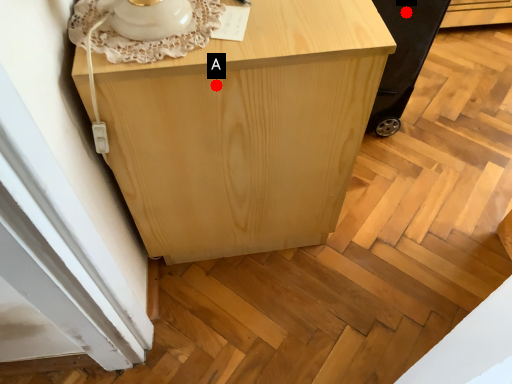
Question: Two points are circled on the image, labeled by A and B beside each circle. Which point appears farthest from the camera in this image?

Choices:
 (A) A is further
 (B) B is further

Answer: (B)